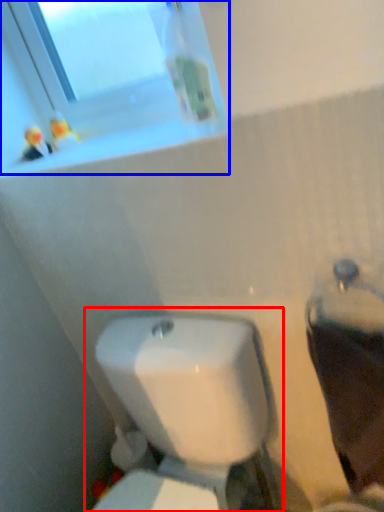
Question: Which of the following is the farthest to the observer, toilet (highlighted by a red box) or window (highlighted by a blue box)?

Choices:
 (A) toilet
 (B) window

Answer: (B)